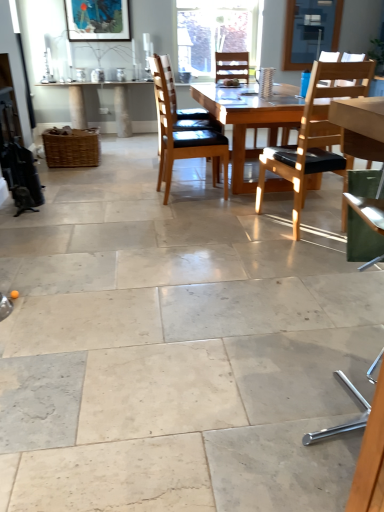
Question: Is transparent glass window screen at upper center to the right of matte wooden picture frame at upper center from the viewer's perspective?

Choices:
 (A) no
 (B) yes

Answer: (B)

Question: From a real-world perspective, is transparent glass window screen at upper center below matte wooden picture frame at upper center?

Choices:
 (A) no
 (B) yes

Answer: (B)

Question: From the image's perspective, is transparent glass window screen at upper center under matte wooden picture frame at upper center?

Choices:
 (A) no
 (B) yes

Answer: (A)

Question: Are transparent glass window screen at upper center and matte wooden picture frame at upper center far apart?

Choices:
 (A) yes
 (B) no

Answer: (A)

Question: Is transparent glass window screen at upper center oriented away from matte wooden picture frame at upper center?

Choices:
 (A) yes
 (B) no

Answer: (B)

Question: From their relative heights in the image, would you say transparent glass window screen at upper center is taller or shorter than transparent glass window at upper center?

Choices:
 (A) tall
 (B) short

Answer: (B)

Question: Would you say transparent glass window screen at upper center is to the left or to the right of transparent glass window at upper center in the picture?

Choices:
 (A) left
 (B) right

Answer: (B)

Question: In terms of size, does transparent glass window screen at upper center appear bigger or smaller than transparent glass window at upper center?

Choices:
 (A) big
 (B) small

Answer: (B)

Question: Is transparent glass window screen at upper center wider or thinner than transparent glass window at upper center?

Choices:
 (A) thin
 (B) wide

Answer: (A)

Question: In the image, is transparent glass window screen at upper center positioned in front of or behind green fabric chair at right, positioned as the 2th chair in right-to-left order?

Choices:
 (A) front
 (B) behind

Answer: (B)

Question: Considering the positions of point (340, 17) and point (349, 195), is point (340, 17) closer or farther from the camera than point (349, 195)?

Choices:
 (A) farther
 (B) closer

Answer: (A)

Question: From their relative heights in the image, would you say transparent glass window screen at upper center is taller or shorter than green fabric chair at right, which is the second chair in left-to-right order?

Choices:
 (A) short
 (B) tall

Answer: (A)

Question: Would you say transparent glass window screen at upper center is inside or outside green fabric chair at right, positioned as the 2th chair in right-to-left order?

Choices:
 (A) inside
 (B) outside

Answer: (B)

Question: In terms of width, does transparent glass window screen at upper center look wider or thinner when compared to brown leather chair at center, acting as the 1th chair starting from the left?

Choices:
 (A) thin
 (B) wide

Answer: (A)

Question: Is point (286, 44) closer or farther from the camera than point (195, 156)?

Choices:
 (A) farther
 (B) closer

Answer: (A)